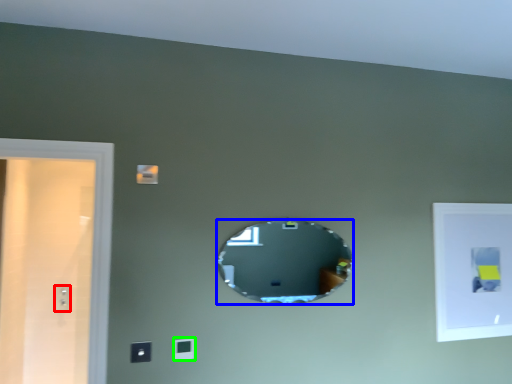
Question: Considering the real-world distances, which object is farthest from electric outlet (highlighted by a red box)? mirror (highlighted by a blue box) or light switch (highlighted by a green box)?

Choices:
 (A) mirror
 (B) light switch

Answer: (A)